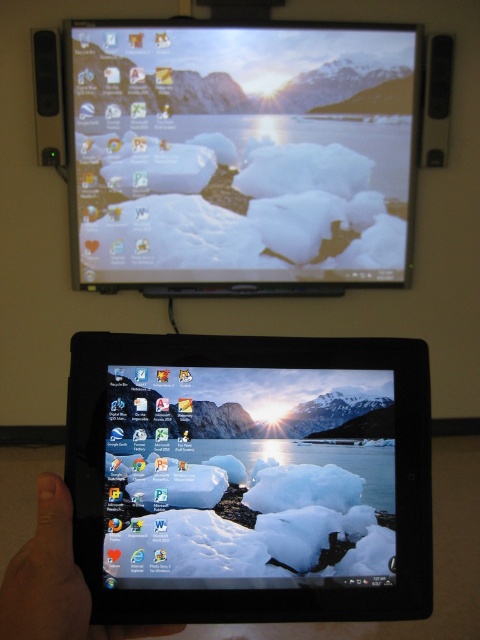
Who is more forward, [156,196] or [156,627]?

Point [156,627]

Who is positioned more to the left, matte plastic desktop at upper center or skinny finger at lower left?

skinny finger at lower left

Where is `matte plastic desktop at upper center`? matte plastic desktop at upper center is located at coordinates [240, 156].

Image resolution: width=480 pixels, height=640 pixels. I want to click on matte plastic desktop at upper center, so click(x=240, y=156).

Does point (139, 531) come behind point (184, 88)?

That is False.

Does black plastic tablet at center appear on the left side of matte plastic desktop at upper center?

No, black plastic tablet at center is not to the left of matte plastic desktop at upper center.

Measure the distance between point (166, 560) and camera.

They are 18.41 inches apart.

Identify the location of black plastic tablet at center. (251, 477).

Can you confirm if black plastic tablet at center is positioned to the left of skinny finger at lower left?

Incorrect, black plastic tablet at center is not on the left side of skinny finger at lower left.

Does black plastic tablet at center have a greater width compared to skinny finger at lower left?

Indeed, black plastic tablet at center has a greater width compared to skinny finger at lower left.

What are the coordinates of `black plastic tablet at center` in the screenshot? It's located at (251, 477).

Find the location of `black plastic tablet at center`. black plastic tablet at center is located at coordinates (251, 477).